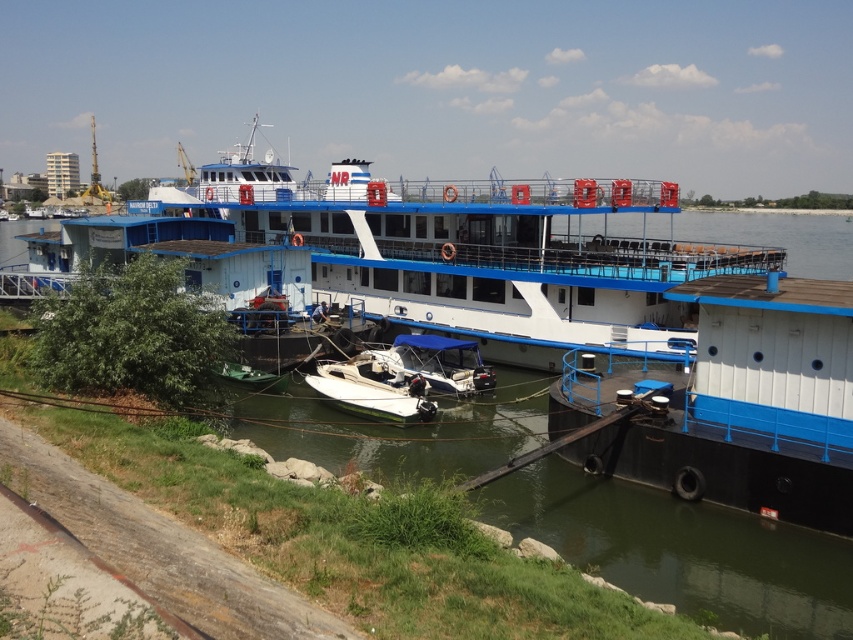
Question: Which is farther from the blue canvas boat at center?

Choices:
 (A) white glossy boat at center
 (B) white painted wood cabin at lower right

Answer: (B)

Question: Can you confirm if white painted wood cabin at lower right is bigger than blue canvas boat at center?

Choices:
 (A) yes
 (B) no

Answer: (B)

Question: Which point is closer to the camera taking this photo?

Choices:
 (A) (779, 400)
 (B) (373, 365)

Answer: (A)

Question: Estimate the real-world distances between objects in this image. Which object is closer to the white painted wood cabin at lower right?

Choices:
 (A) white glossy boat at center
 (B) blue canvas boat at center

Answer: (B)

Question: Is white glossy boat at center to the left of blue canvas boat at center from the viewer's perspective?

Choices:
 (A) yes
 (B) no

Answer: (A)

Question: Does white painted wood cabin at lower right have a larger size compared to white glossy boat at center?

Choices:
 (A) no
 (B) yes

Answer: (A)